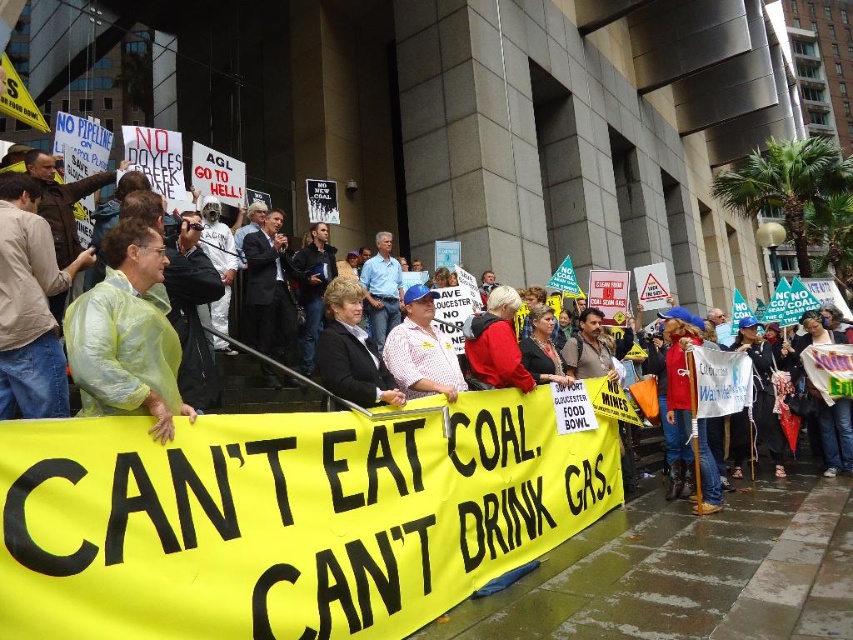
You are a photographer standing at the edge of the protest scene. You want to capture a photo that includes both the red matte jacket at center and the light blue shirt at center in the same frame. Your camera has a maximum focal length that allows capturing objects up to 5 meters apart. Will you be able to include both subjects in your photo?

The red matte jacket at center and light blue shirt at center are 5.49 meters apart from each other. Since the distance between them exceeds the camera maximum focal length of 5 meters, you will not be able to include both subjects in the same photo.

You are a photographer at the protest scene described. You want to capture a photo where both the black fabric jacket at center and the dark suit at center are visible. Given their sizes, which one will appear larger in the photo?

The dark suit at center will appear larger in the photo because it has a bigger size compared to the black fabric jacket at center.

From the picture: You are a photographer trying to capture a clear photo of the protesters holding the yellow banner. You notice two individuals in the foreground wearing a red matte jacket at center and a light blue shirt at center. Which protester should you focus on to ensure their clothing doesn not block the banner text?

The red matte jacket at center occupies less space than the light blue shirt at center, so focusing on the protester wearing the red matte jacket at center would be better to avoid blocking the banner text.